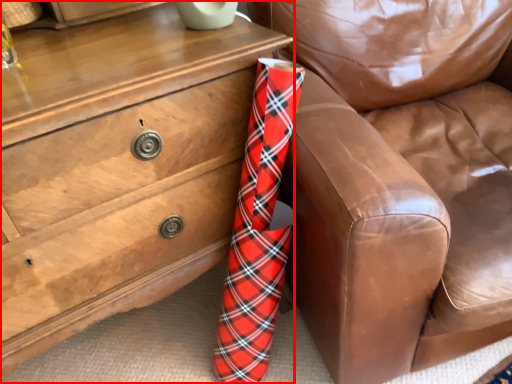
Question: From the image's perspective, what is the correct spatial positioning of chest of drawers (annotated by the red box) in reference to furniture?

Choices:
 (A) above
 (B) below

Answer: (B)